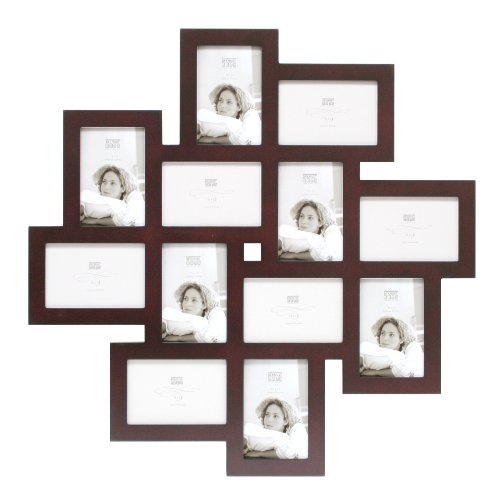
Locate an element on the screen. The image size is (500, 500). frames with no people is located at coordinates 165,397, 299,311, 419,238, 329,113, 210,195, 97,279.